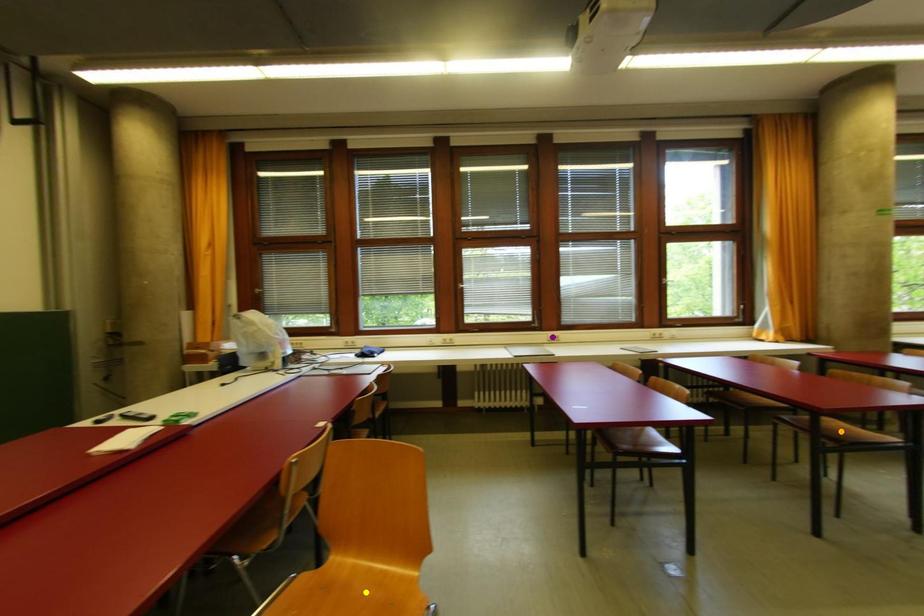
Order these from nearest to farthest:
purple point
orange point
yellow point

1. yellow point
2. orange point
3. purple point